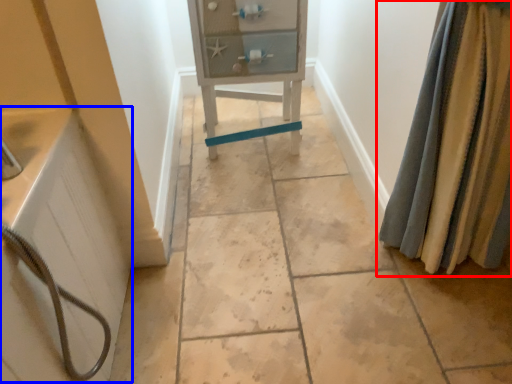
Question: Which object appears farthest to the camera in this image, curtain (highlighted by a red box) or bath (highlighted by a blue box)?

Choices:
 (A) curtain
 (B) bath

Answer: (A)